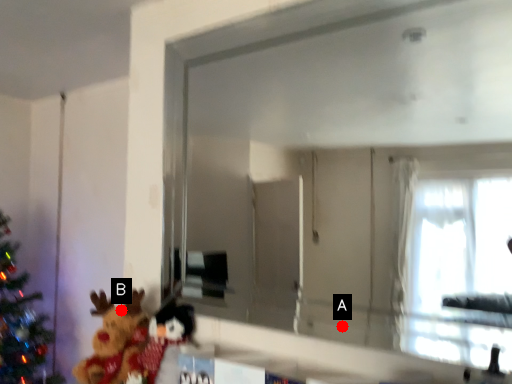
Question: Two points are circled on the image, labeled by A and B beside each circle. Among these points, which one is nearest to the camera?

Choices:
 (A) A is closer
 (B) B is closer

Answer: (A)